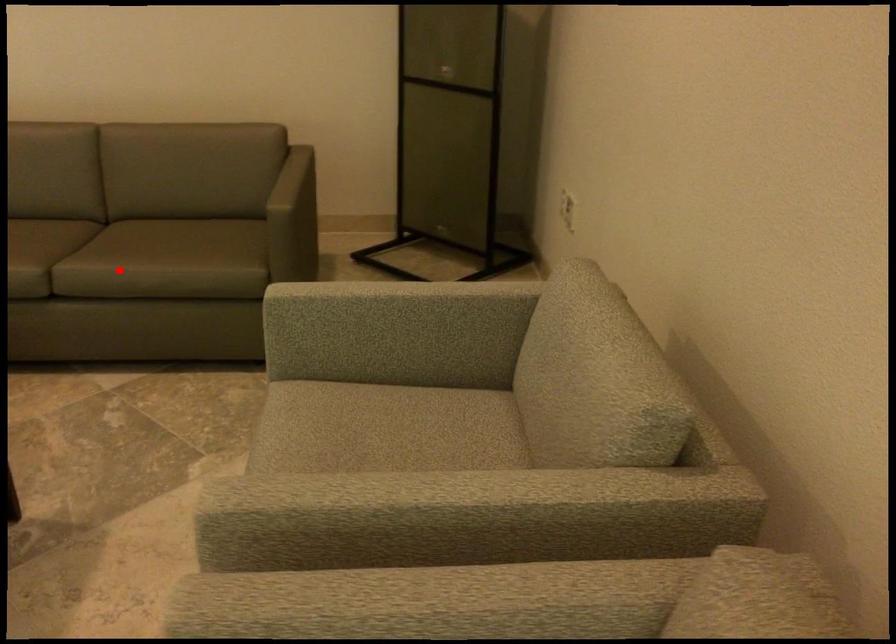
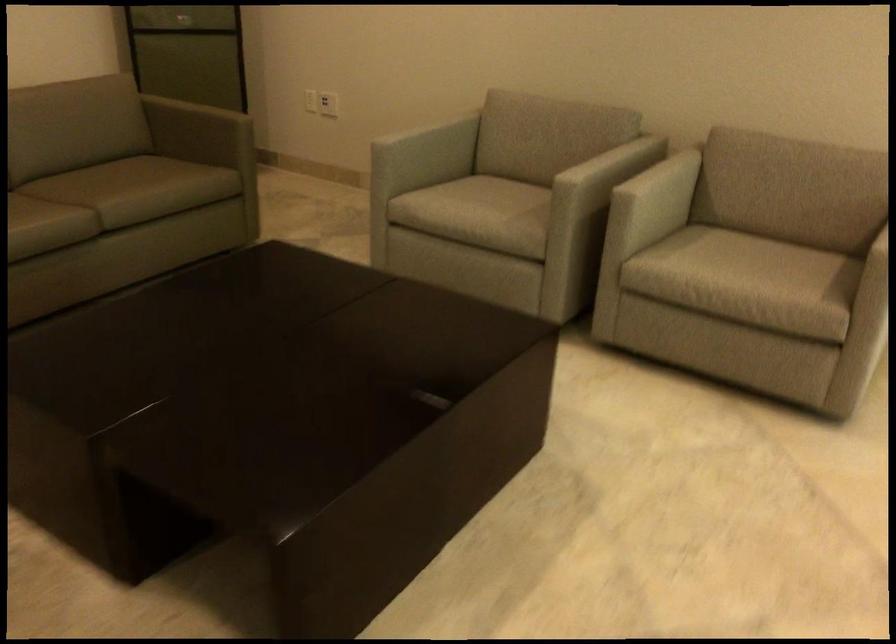
Locate, in the second image, the point that corresponds to the highlighted location in the first image.

(145, 187)